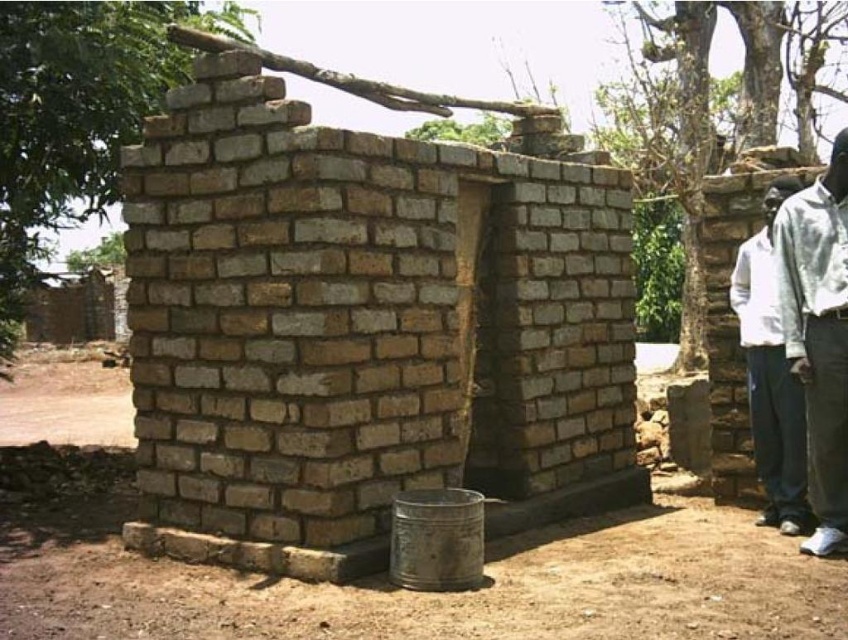
You are a traveler who has just arrived at this brick structure. You notice two shirts hanging on a line near the entrance. Which shirt would you say is taller between the light gray shirt at right and the white cotton shirt at right?

The light gray shirt at right is much taller than the white cotton shirt at right according to the description.

You are a delivery person carrying a package that requires a 2 meter clearance to pass through a narrow path between the brown rough brick wall at center and the light gray shirt at right. Can you safely navigate through this path without hitting either object?

The distance between the brown rough brick wall at center and the light gray shirt at right is 2.17 meters, which is greater than the required 2 meter clearance. Therefore, you can safely navigate through the path without hitting either object.